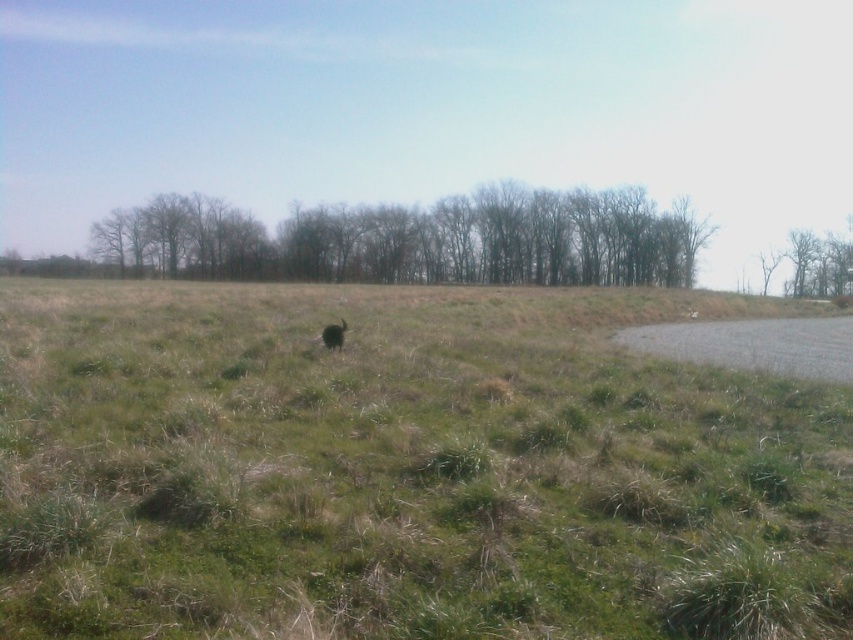
Can you confirm if bare branches at center is positioned above brown furry animal at center?

Yes, bare branches at center is above brown furry animal at center.

Can you confirm if bare branches at center is positioned below brown furry animal at center?

Incorrect, bare branches at center is not positioned below brown furry animal at center.

Between point (668, 243) and point (332, 346), which one is positioned in front?

Positioned in front is point (332, 346).

Locate an element on the screen. This screenshot has height=640, width=853. bare branches at center is located at coordinates (418, 240).

Between point (138, 531) and point (337, 342), which one is positioned in front?

Point (138, 531)

Which is behind, point (94, 452) or point (343, 330)?

The point (343, 330) is behind.

Does point (428, 339) lie in front of point (323, 340)?

No.

The height and width of the screenshot is (640, 853). Identify the location of green grassy field at center. (403, 472).

Is point (515, 536) positioned behind point (627, 204)?

No, it is not.

Identify the location of green grassy field at center. (403, 472).

Where is `green grassy field at center`? green grassy field at center is located at coordinates (403, 472).